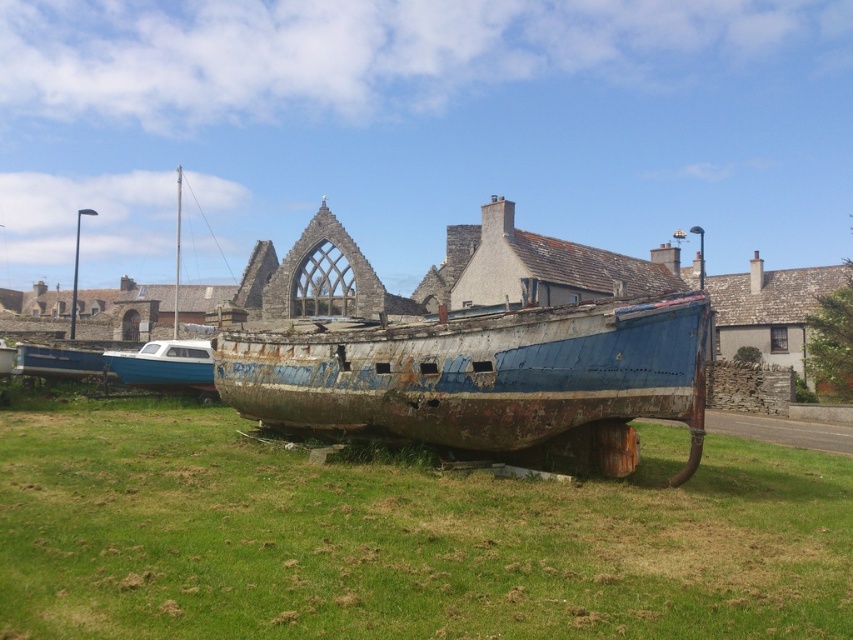
Who is taller, rusty metal boat at center or rusty metal boat at lower left?

Standing taller between the two is rusty metal boat at center.

Is rusty metal boat at center further to camera compared to rusty metal boat at lower left?

No, rusty metal boat at center is closer to the viewer.

What do you see at coordinates (486, 380) in the screenshot?
I see `rusty metal boat at center` at bounding box center [486, 380].

The image size is (853, 640). What are the coordinates of `rusty metal boat at center` in the screenshot? It's located at (486, 380).

From the picture: Is rusty metal boat at center taller than blue painted wood boat at left?

Yes, rusty metal boat at center is taller than blue painted wood boat at left.

Measure the distance from rusty metal boat at center to blue painted wood boat at left.

A distance of 33.93 meters exists between rusty metal boat at center and blue painted wood boat at left.

Identify the location of rusty metal boat at center. (486, 380).

Is blue painted wood boat at left to the left of rusty metal boat at lower left from the viewer's perspective?

Incorrect, blue painted wood boat at left is not on the left side of rusty metal boat at lower left.

Is point (142, 371) less distant than point (20, 364)?

No, it is not.

Locate an element on the screen. The height and width of the screenshot is (640, 853). blue painted wood boat at left is located at coordinates (166, 368).